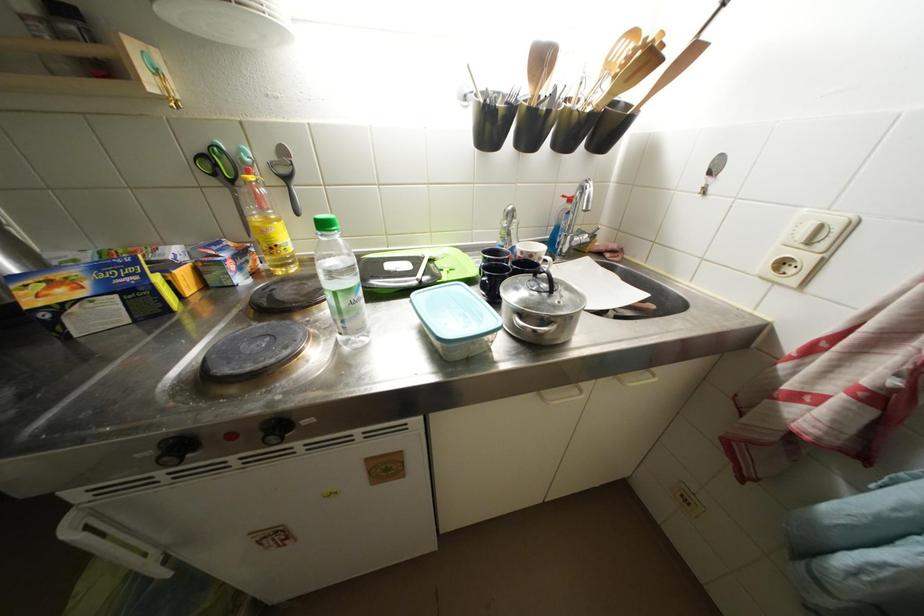
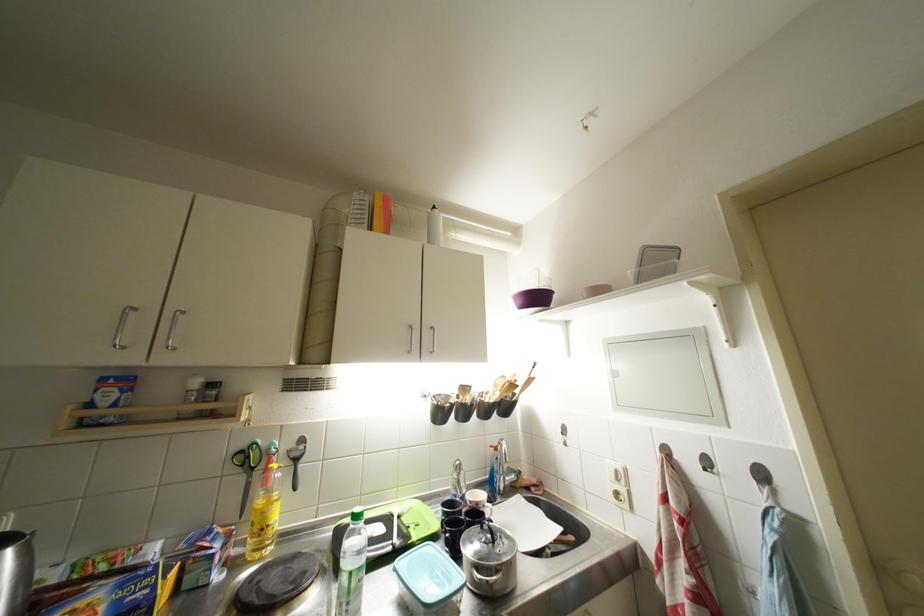
Where in the second image is the point corresponding to [208,151] from the first image?

(249, 450)